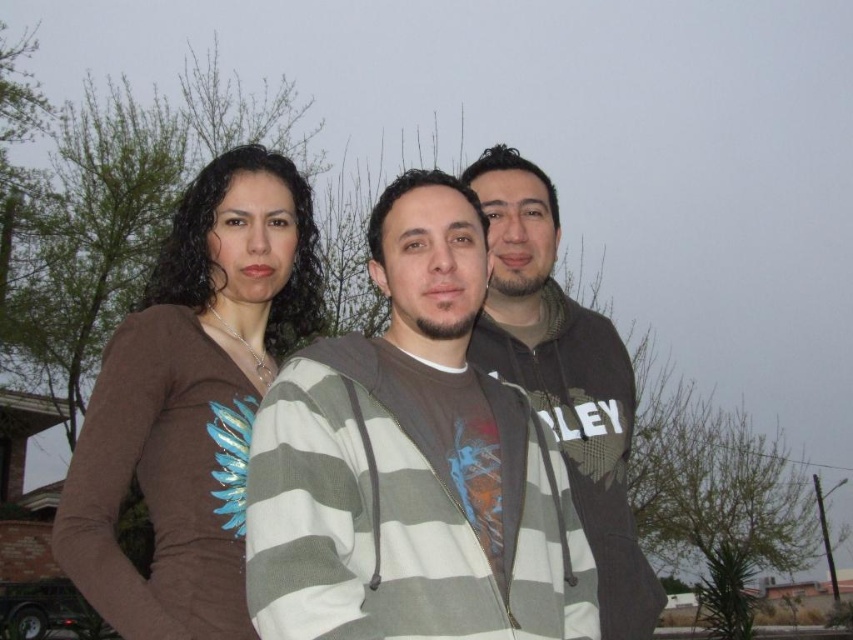
Can you confirm if brown matte shirt at left is positioned above dark gray zip-up hoodie at center?

Yes, brown matte shirt at left is above dark gray zip-up hoodie at center.

Can you confirm if brown matte shirt at left is taller than dark gray zip-up hoodie at center?

Yes, brown matte shirt at left is taller than dark gray zip-up hoodie at center.

Is point (242, 545) positioned behind point (659, 611)?

No, it is not.

Locate an element on the screen. This screenshot has height=640, width=853. brown matte shirt at left is located at coordinates (190, 401).

What do you see at coordinates (563, 378) in the screenshot? This screenshot has height=640, width=853. I see `dark gray zip-up hoodie at center` at bounding box center [563, 378].

Does dark gray zip-up hoodie at center appear under brown matte shirt at upper left?

Yes.

Describe the element at coordinates (563, 378) in the screenshot. I see `dark gray zip-up hoodie at center` at that location.

Find the location of `dark gray zip-up hoodie at center`. dark gray zip-up hoodie at center is located at coordinates (563, 378).

Is brown matte shirt at left bigger than brown matte shirt at upper left?

No.

Is point (152, 481) positioned after point (515, 344)?

No, it is in front of (515, 344).

Where is `brown matte shirt at left`? brown matte shirt at left is located at coordinates (190, 401).